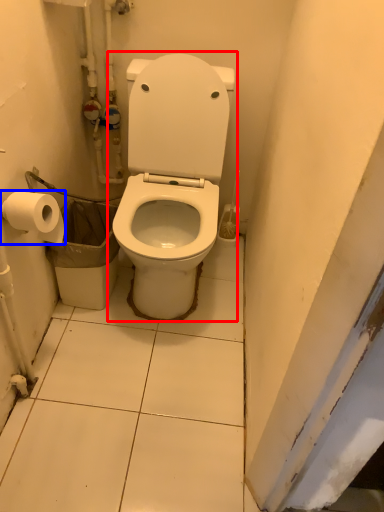
Question: Which point is closer to the camera, toilet (highlighted by a red box) or toilet paper (highlighted by a blue box)?

Choices:
 (A) toilet
 (B) toilet paper

Answer: (A)